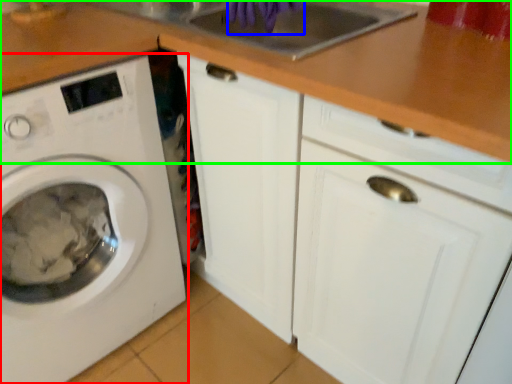
Question: Considering the real-world distances, which object is farthest from washing machine (highlighted by a red box)? hand (highlighted by a blue box) or counter top (highlighted by a green box)?

Choices:
 (A) hand
 (B) counter top

Answer: (A)